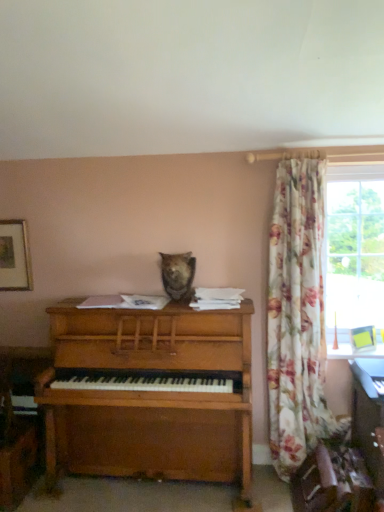
You are a GUI agent. You are given a task and a screenshot of the screen. Output one action in this format:
    pyautogui.click(x=<x>, y=<y>)
    Task: Click on the vacant location below fuzzy brown bear at center (from a real-world perspective)
    Image resolution: width=384 pixels, height=512 pixels.
    Given the screenshot: What is the action you would take?
    [x=173, y=306]